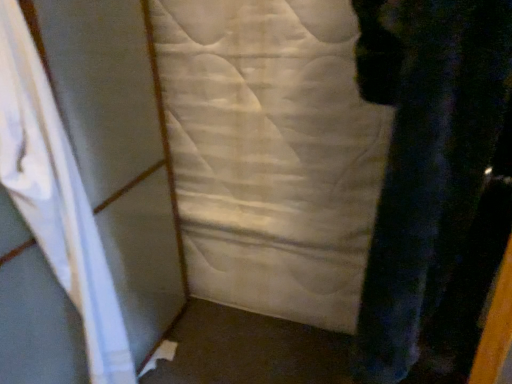
Question: Considering the positions of white quilted fabric at center and white fabric curtain at left in the image, is white quilted fabric at center wider or thinner than white fabric curtain at left?

Choices:
 (A) wide
 (B) thin

Answer: (B)

Question: From the image's perspective, relative to white fabric curtain at left, is white quilted fabric at center above or below?

Choices:
 (A) above
 (B) below

Answer: (A)

Question: Based on their sizes in the image, would you say white quilted fabric at center is bigger or smaller than white fabric curtain at left?

Choices:
 (A) big
 (B) small

Answer: (A)

Question: From a real-world perspective, relative to white quilted fabric at center, is white fabric curtain at left vertically above or below?

Choices:
 (A) above
 (B) below

Answer: (A)

Question: Choose the correct answer: Is white fabric curtain at left inside white quilted fabric at center or outside it?

Choices:
 (A) inside
 (B) outside

Answer: (B)

Question: Considering their positions, is white fabric curtain at left located in front of or behind white quilted fabric at center?

Choices:
 (A) front
 (B) behind

Answer: (A)

Question: From the image's perspective, is white fabric curtain at left located above or below white quilted fabric at center?

Choices:
 (A) above
 (B) below

Answer: (B)